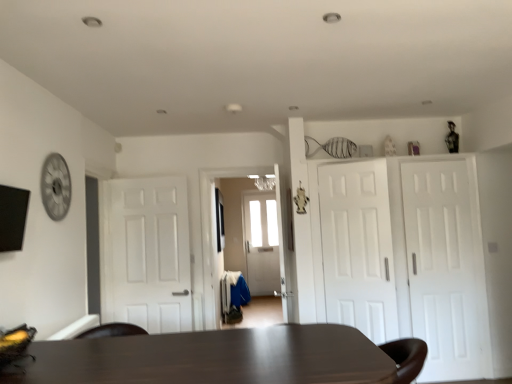
Question: Does white matte door at center, acting as the 2th door starting from the left, have a greater height compared to white matte door at center, the 4th door in the right-to-left sequence?

Choices:
 (A) no
 (B) yes

Answer: (A)

Question: Does white matte door at center, which appears as the 3th door when viewed from the right, have a lesser height compared to white matte door at center, the 4th door in the right-to-left sequence?

Choices:
 (A) yes
 (B) no

Answer: (A)

Question: Considering the relative sizes of white matte door at center, acting as the 2th door starting from the left, and white matte door at center, the 4th door in the right-to-left sequence, in the image provided, is white matte door at center, acting as the 2th door starting from the left, thinner than white matte door at center, the 4th door in the right-to-left sequence,?

Choices:
 (A) yes
 (B) no

Answer: (A)

Question: Considering the relative positions of white matte door at center, acting as the 2th door starting from the left, and white matte door at center, arranged as the 1th door when viewed from the left, in the image provided, is white matte door at center, acting as the 2th door starting from the left, behind white matte door at center, arranged as the 1th door when viewed from the left,?

Choices:
 (A) no
 (B) yes

Answer: (A)

Question: From the image's perspective, is white matte door at center, acting as the 2th door starting from the left, located beneath white matte door at center, the 4th door in the right-to-left sequence?

Choices:
 (A) yes
 (B) no

Answer: (B)

Question: Can we say white matte door at center, acting as the 2th door starting from the left, lies outside white matte door at center, the 4th door in the right-to-left sequence?

Choices:
 (A) yes
 (B) no

Answer: (A)

Question: Is dark brown wooden table at center facing towards white matte door at center, the 4th door in the right-to-left sequence?

Choices:
 (A) no
 (B) yes

Answer: (A)

Question: From a real-world perspective, is dark brown wooden table at center beneath white matte door at center, the 4th door in the right-to-left sequence?

Choices:
 (A) yes
 (B) no

Answer: (A)

Question: Does dark brown wooden table at center have a greater height compared to white matte door at center, arranged as the 1th door when viewed from the left?

Choices:
 (A) yes
 (B) no

Answer: (B)

Question: Can you confirm if dark brown wooden table at center is thinner than white matte door at center, arranged as the 1th door when viewed from the left?

Choices:
 (A) no
 (B) yes

Answer: (A)

Question: Is dark brown wooden table at center directly adjacent to white matte door at center, arranged as the 1th door when viewed from the left?

Choices:
 (A) no
 (B) yes

Answer: (A)

Question: Is dark brown wooden table at center at the right side of white matte door at center, the 4th door in the right-to-left sequence?

Choices:
 (A) no
 (B) yes

Answer: (B)

Question: Is white matte door at right, the 3th door in the left-to-right sequence, completely or partially outside of dark brown wooden table at center?

Choices:
 (A) no
 (B) yes

Answer: (B)